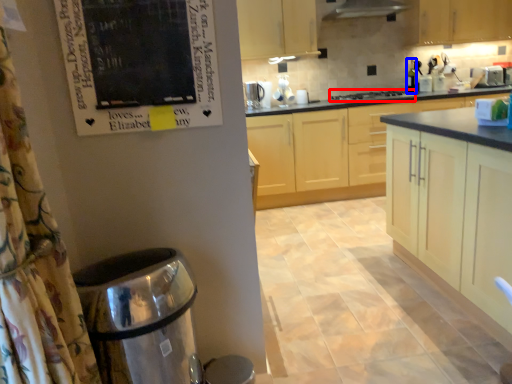
Question: Which object appears farthest to the camera in this image, home appliance (highlighted by a red box) or bottle (highlighted by a blue box)?

Choices:
 (A) home appliance
 (B) bottle

Answer: (B)